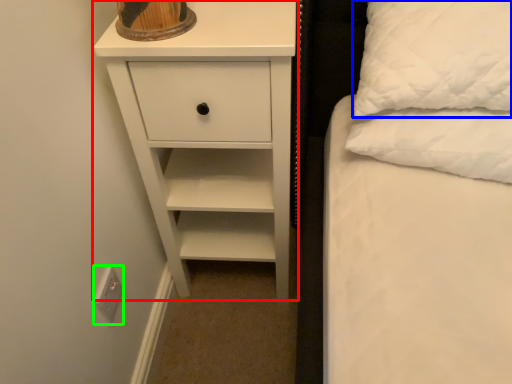
Question: Which is farther away from chest of drawers (highlighted by a red box)? pillow (highlighted by a blue box) or electric outlet (highlighted by a green box)?

Choices:
 (A) pillow
 (B) electric outlet

Answer: (B)